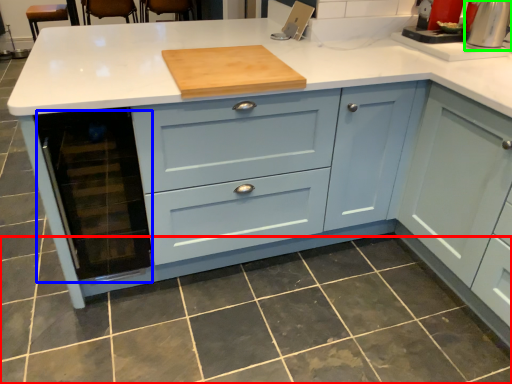
Question: Based on their relative distances, which object is nearer to tile (highlighted by a red box)? Choose from appliance (highlighted by a blue box) and home appliance (highlighted by a green box).

Choices:
 (A) appliance
 (B) home appliance

Answer: (A)